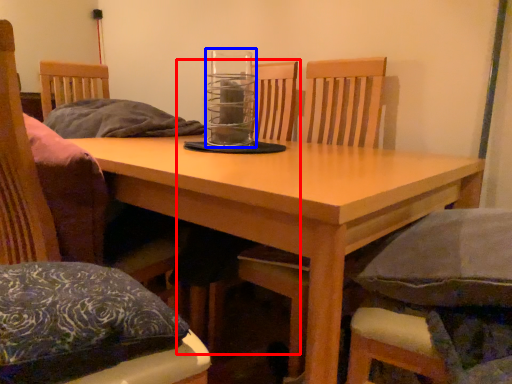
Question: Among these objects, which one is farthest to the camera, armchair (highlighted by a red box) or glass jar (highlighted by a blue box)?

Choices:
 (A) armchair
 (B) glass jar

Answer: (A)